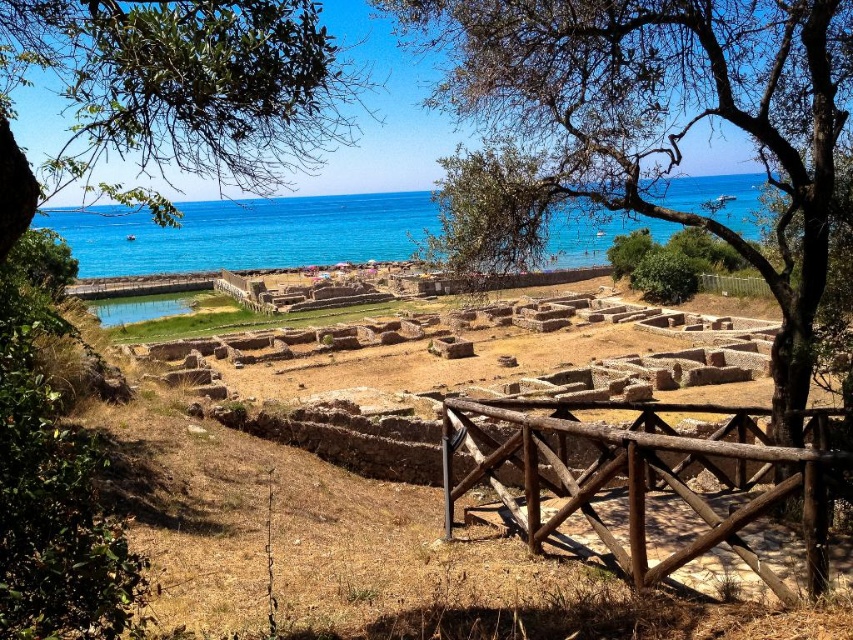
You are standing on the archaeological site and want to take a photo of the blue water at upper center. To avoid having the green leafy tree at upper left in the background, should you move to the right or left?

You should move to the right to avoid the green leafy tree at upper left, as it is positioned on the left side of the blue water at upper center.

You are standing at the archaeological site and want to take a photo of the brown wooden fence at lower right without the green leafy tree at center blocking the view. Is there a way to position yourself to achieve this?

The brown wooden fence at lower right is behind the green leafy tree at center, so you can move to a position where the green leafy tree at center is between you and the brown wooden fence at lower right to avoid blocking.

You are a tourist standing at the archaeological site. You want to take a photo that includes both the green leafy tree at center and the brown wooden fence at lower right. Which object will occupy more horizontal space in your photo?

The green leafy tree at center will occupy more horizontal space in your photo because its width surpasses that of the brown wooden fence at lower right.